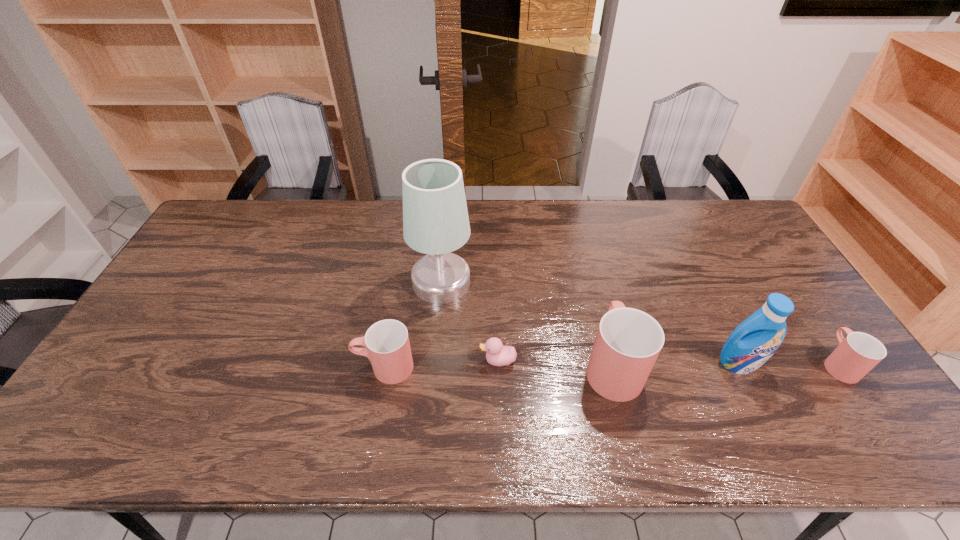
Locate an element on the screen. This screenshot has width=960, height=540. free space at the right edge is located at coordinates (787, 280).

In the image, there is a desktop. Identify the location of vacant area at the far left corner. This screenshot has width=960, height=540. (213, 232).

The width and height of the screenshot is (960, 540). Find the location of `free space that is in between the third object from left to right and the leftmost cup`. free space that is in between the third object from left to right and the leftmost cup is located at coordinates (442, 364).

This screenshot has height=540, width=960. What are the coordinates of `free space between the duckling and the farthest object` in the screenshot? It's located at (469, 321).

The width and height of the screenshot is (960, 540). Identify the location of free space between the third object from right to left and the fifth shortest object. (676, 364).

Identify the location of vacant space in between the leftmost cup and the third tallest object. Image resolution: width=960 pixels, height=540 pixels. (498, 366).

Identify which object is the fourth closest to the duckling. Please provide its 2D coordinates. Your answer should be formatted as a tuple, i.e. [(x, y)], where the tuple contains the x and y coordinates of a point satisfying the conditions above.

[(755, 340)]

Where is `object that ranks as the closest to the shortest object`? object that ranks as the closest to the shortest object is located at coordinates (435, 218).

Identify which cup is located as the second nearest to the rightmost object. Please provide its 2D coordinates. Your answer should be formatted as a tuple, i.e. [(x, y)], where the tuple contains the x and y coordinates of a point satisfying the conditions above.

[(387, 346)]

Point out which cup is positioned as the third nearest to the lampshade. Please provide its 2D coordinates. Your answer should be formatted as a tuple, i.e. [(x, y)], where the tuple contains the x and y coordinates of a point satisfying the conditions above.

[(857, 354)]